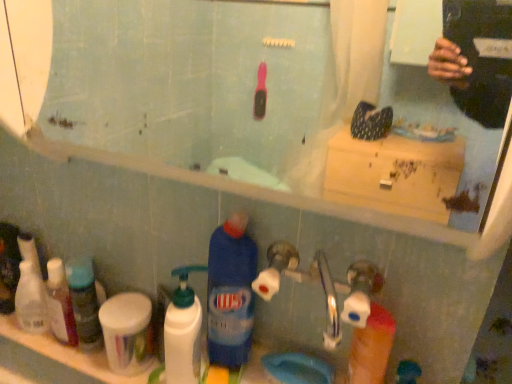
Question: Does white plastic cup at lower left, which appears as the 3th toiletry when viewed from the left, have a smaller size compared to white plastic bottles at left, which appears as the first toiletry when viewed from the left?

Choices:
 (A) yes
 (B) no

Answer: (B)

Question: Is white plastic cup at lower left, which appears as the 3th toiletry when viewed from the left, not inside white plastic bottles at left, which appears as the first toiletry when viewed from the left?

Choices:
 (A) yes
 (B) no

Answer: (A)

Question: Does white plastic cup at lower left, acting as the 1th toiletry starting from the right, come behind white plastic bottles at left, which appears as the first toiletry when viewed from the left?

Choices:
 (A) yes
 (B) no

Answer: (B)

Question: Does white plastic cup at lower left, which appears as the 3th toiletry when viewed from the left, touch white plastic bottles at left, the 3th toiletry viewed from the right?

Choices:
 (A) no
 (B) yes

Answer: (A)

Question: From the image's perspective, is white plastic cup at lower left, acting as the 1th toiletry starting from the right, on top of white plastic bottles at left, which appears as the first toiletry when viewed from the left?

Choices:
 (A) yes
 (B) no

Answer: (B)

Question: From the image's perspective, is white plastic cup at lower left, which appears as the 3th toiletry when viewed from the left, located beneath white plastic bottles at left, which appears as the first toiletry when viewed from the left?

Choices:
 (A) yes
 (B) no

Answer: (A)

Question: Is translucent plastic bottles at left, which is the second toiletry in left-to-right order, positioned in front of white plastic cup at lower left, which appears as the 3th toiletry when viewed from the left?

Choices:
 (A) no
 (B) yes

Answer: (A)

Question: Considering the relative sizes of translucent plastic bottles at left, which is the second toiletry in left-to-right order, and white plastic cup at lower left, which appears as the 3th toiletry when viewed from the left, in the image provided, is translucent plastic bottles at left, which is the second toiletry in left-to-right order, shorter than white plastic cup at lower left, which appears as the 3th toiletry when viewed from the left,?

Choices:
 (A) no
 (B) yes

Answer: (B)

Question: Is white plastic cup at lower left, which appears as the 3th toiletry when viewed from the left, a part of translucent plastic bottles at left, which is the second toiletry in left-to-right order?

Choices:
 (A) no
 (B) yes

Answer: (A)

Question: From a real-world perspective, does translucent plastic bottles at left, which is the second toiletry in right-to-left order, stand above white plastic cup at lower left, acting as the 1th toiletry starting from the right?

Choices:
 (A) yes
 (B) no

Answer: (B)

Question: Is translucent plastic bottles at left, which is the second toiletry in left-to-right order, outside white plastic cup at lower left, acting as the 1th toiletry starting from the right?

Choices:
 (A) no
 (B) yes

Answer: (B)

Question: Does translucent plastic bottles at left, which is the second toiletry in left-to-right order, have a smaller size compared to white plastic cup at lower left, which appears as the 3th toiletry when viewed from the left?

Choices:
 (A) no
 (B) yes

Answer: (B)

Question: From a real-world perspective, does blue plastic bottle at lower center, the second cleaning product from the left, stand above white plastic pump bottle at lower left, placed as the 2th cleaning product when sorted from right to left?

Choices:
 (A) yes
 (B) no

Answer: (A)